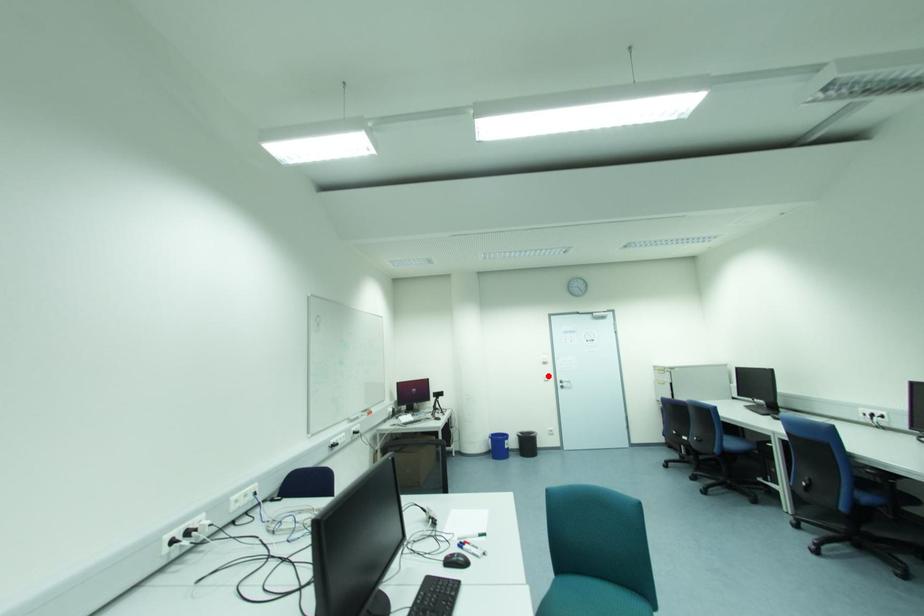
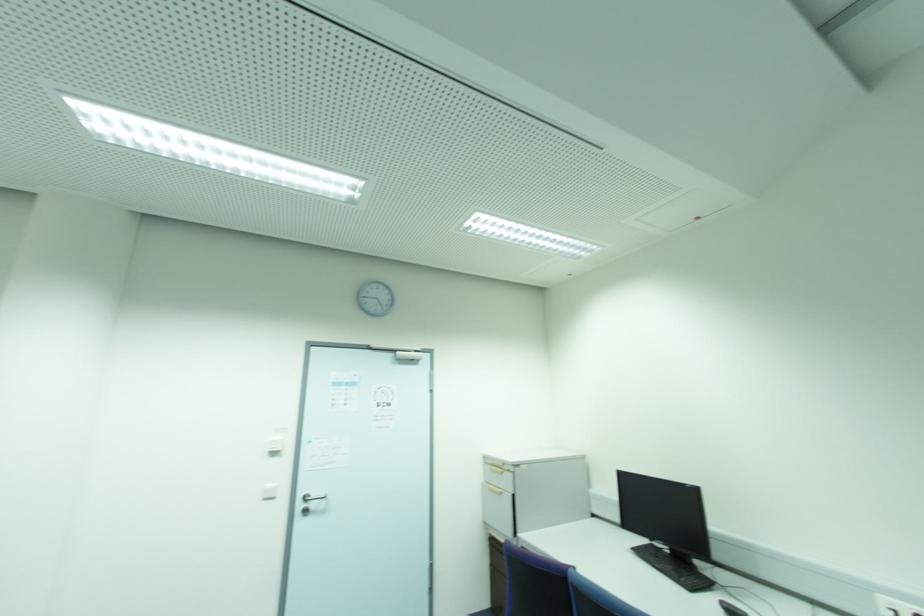
Where in the second image is the point corresponding to the highlighted location from the first image?

(274, 485)